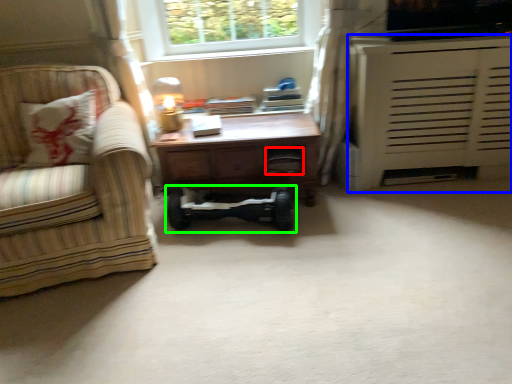
Question: Based on their relative distances, which object is nearer to drawer (highlighted by a red box)? Choose from cabinetry (highlighted by a blue box) and baby carriage (highlighted by a green box).

Choices:
 (A) cabinetry
 (B) baby carriage

Answer: (B)